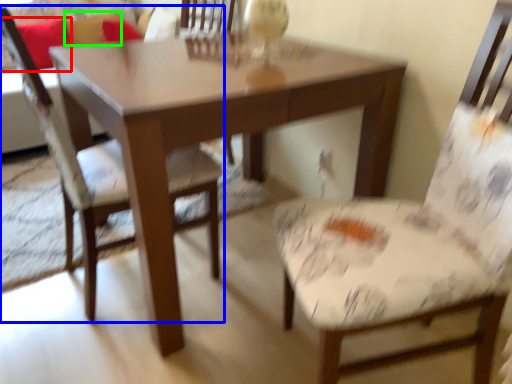
Question: Based on their relative distances, which object is nearer to pillow (highlighted by a red box)? Choose from chair (highlighted by a blue box) and pillow (highlighted by a green box).

Choices:
 (A) chair
 (B) pillow

Answer: (B)